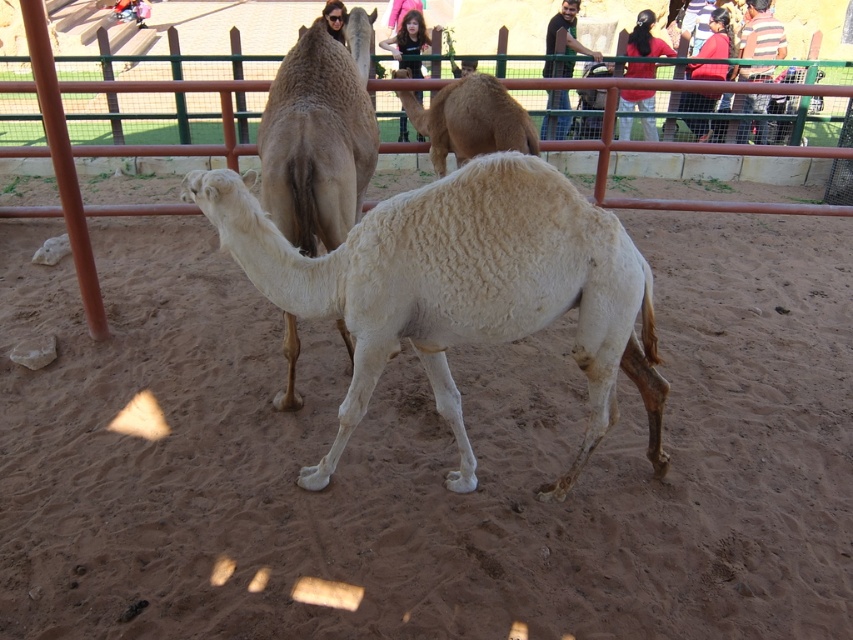
What is the 2D coordinate of the brown sandy dirt at center?

The brown sandy dirt at center is located at the 2D coordinate point of (425,458).

You are standing at the origin point of the coordinate system. You want to walk to the brown sandy dirt at center. In which direction should you go?

The brown sandy dirt at center is located at coordinate point (425, 458). Since the x coordinate is positive, you should move to the right. The y coordinate is positive, so you should move forward. Therefore, you should go in the direction of right and forward to reach the brown sandy dirt at center.

You are a zookeeper standing in front of the camel enclosure. You need to throw a treat to the camel at the center. The treat can reach up to 7 feet. Will the treat reach the brown sandy dirt at center?

The brown sandy dirt at center is 7.50 feet away from viewer. Since the treat can only reach up to 7 feet, it won